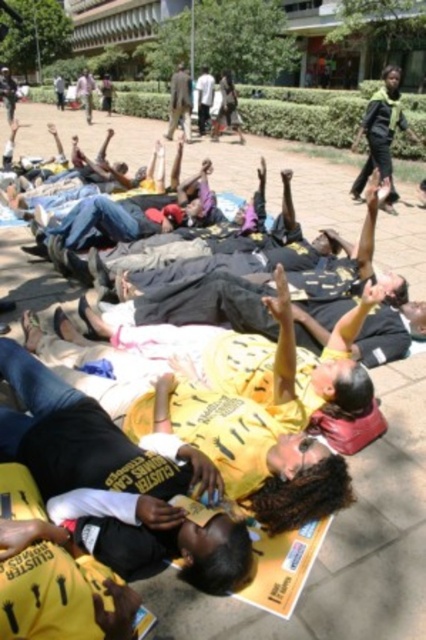
Can you confirm if green fabric scarf at upper right is positioned above dark brown suit at center?

No.

From the picture: Does green fabric scarf at upper right appear under dark brown suit at center?

Yes, green fabric scarf at upper right is below dark brown suit at center.

This screenshot has width=426, height=640. I want to click on green fabric scarf at upper right, so click(382, 134).

Where is `green fabric scarf at upper right`? The width and height of the screenshot is (426, 640). green fabric scarf at upper right is located at coordinates (382, 134).